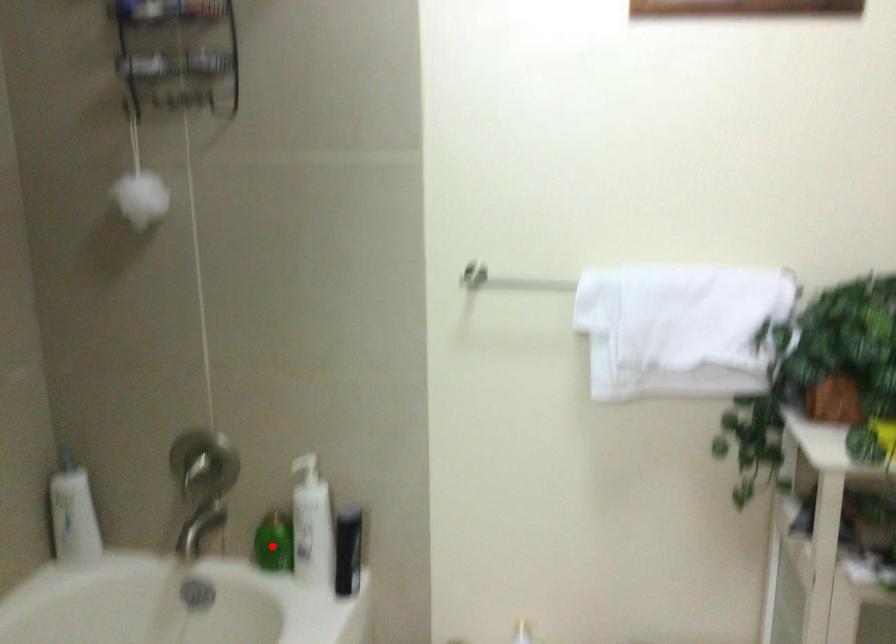
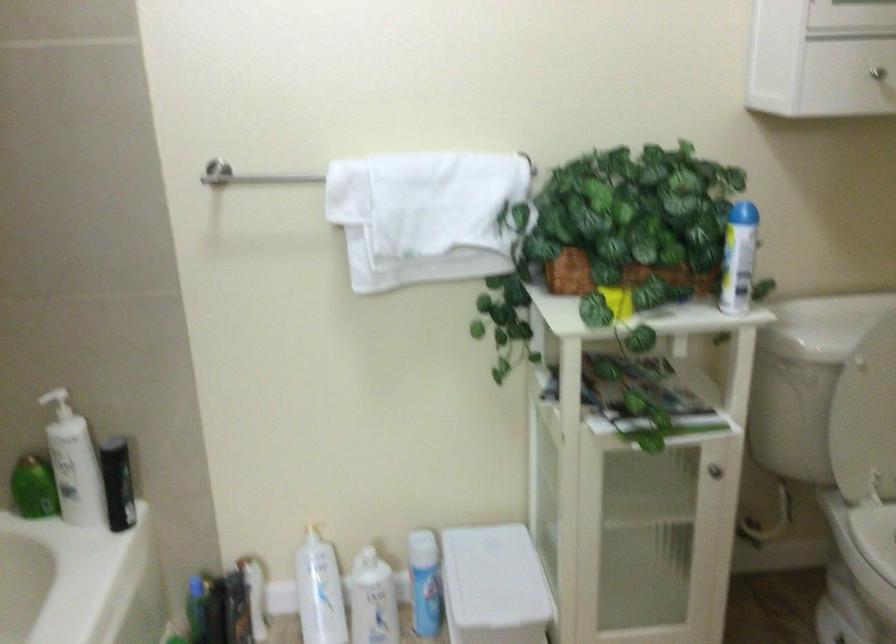
Locate, in the second image, the point that corresponds to the highlighted location in the first image.

(33, 488)